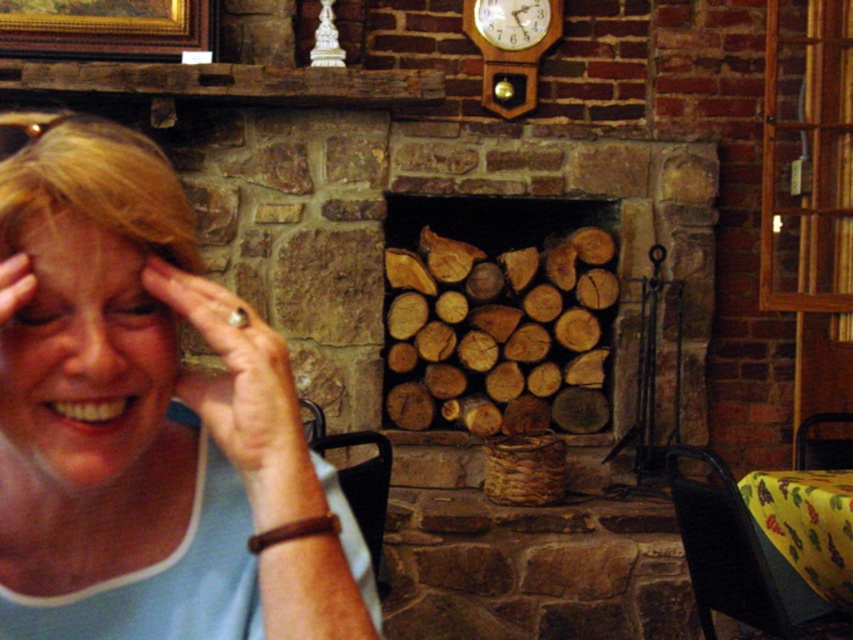
The height and width of the screenshot is (640, 853). What do you see at coordinates (236, 378) in the screenshot? I see `matte skin hand at left` at bounding box center [236, 378].

Can you confirm if matte skin hand at left is positioned below light brown skin at center?

Yes.

Between point (194, 371) and point (103, 250), which one is positioned behind?

The point (194, 371) is behind.

This screenshot has width=853, height=640. What are the coordinates of `matte skin hand at left` in the screenshot? It's located at (236, 378).

Is wooden logs at center to the right of wooden clock at upper center from the viewer's perspective?

No, wooden logs at center is not to the right of wooden clock at upper center.

Consider the image. Can you confirm if wooden logs at center is shorter than wooden clock at upper center?

No, wooden logs at center is not shorter than wooden clock at upper center.

Identify the location of wooden logs at center. This screenshot has width=853, height=640. (498, 310).

Image resolution: width=853 pixels, height=640 pixels. What are the coordinates of `wooden logs at center` in the screenshot? It's located at (498, 310).

Between matte blue shirt at center and gold-framed painting at upper left, which one is positioned higher?

gold-framed painting at upper left is above.

Does matte blue shirt at center have a smaller size compared to gold-framed painting at upper left?

No, matte blue shirt at center is not smaller than gold-framed painting at upper left.

The image size is (853, 640). I want to click on matte blue shirt at center, so click(148, 419).